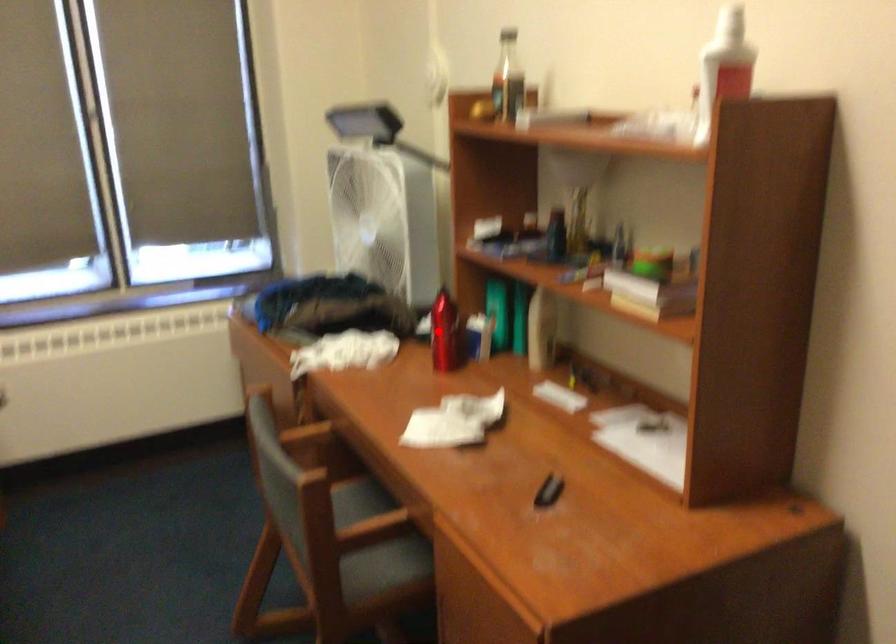
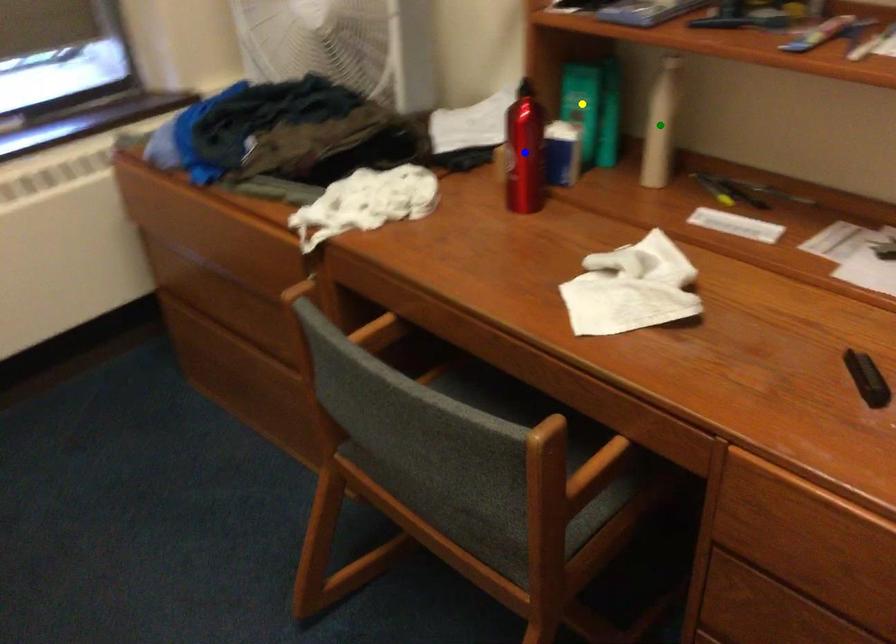
Question: I am providing you with two images of the same scene from different viewpoints. A red point is marked on the first image. You are given multiple points on the second image. Which spot in image 2 lines up with the point in image 1?

Choices:
 (A) yellow point
 (B) green point
 (C) blue point

Answer: (C)